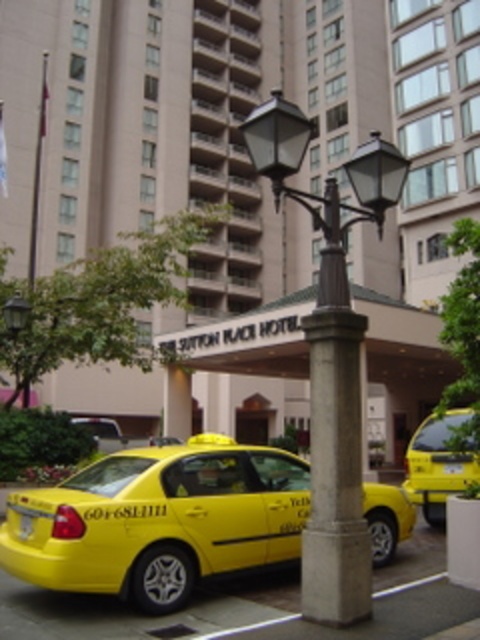
This screenshot has width=480, height=640. Describe the element at coordinates (239, 132) in the screenshot. I see `yellow plastic taxi cab at center` at that location.

This screenshot has width=480, height=640. In order to click on yellow plastic taxi cab at center in this screenshot , I will do `click(239, 132)`.

Does point (266, 8) lie in front of point (11, 529)?

No, (266, 8) is behind (11, 529).

At what (x,y) coordinates should I click in order to perform the action: click on yellow plastic taxi cab at center. Please return your answer as a coordinate pair (x, y). The image size is (480, 640). Looking at the image, I should click on (239, 132).

Which is below, yellow matte taxi at lower left or yellow matte taxi cab at lower left?

yellow matte taxi cab at lower left

Between yellow matte taxi at lower left and yellow matte taxi cab at lower left, which one appears on the right side from the viewer's perspective?

From the viewer's perspective, yellow matte taxi at lower left appears more on the right side.

The image size is (480, 640). What do you see at coordinates (159, 520) in the screenshot?
I see `yellow matte taxi at lower left` at bounding box center [159, 520].

Where is `yellow matte taxi at lower left`? The width and height of the screenshot is (480, 640). yellow matte taxi at lower left is located at coordinates (159, 520).

Which of these two, yellow plastic taxi cab at center or polished bronze streetlight at center, stands shorter?

With less height is polished bronze streetlight at center.

Does point (361, 3) come closer to viewer compared to point (326, 429)?

No, it is behind (326, 429).

Identify the location of yellow plastic taxi cab at center. Image resolution: width=480 pixels, height=640 pixels. (239, 132).